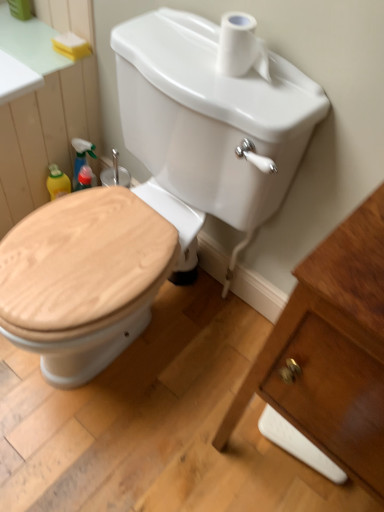
Find the location of a particular element. vacant area situated to the left side of white matte toilet paper at upper center is located at coordinates (192, 51).